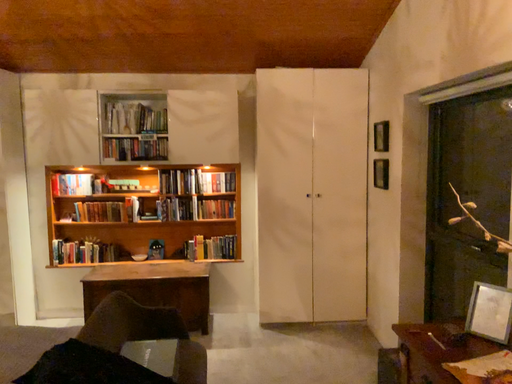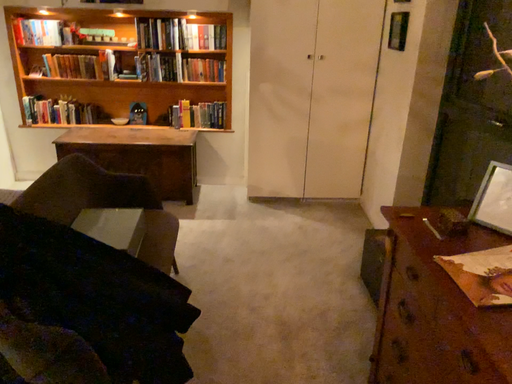
Question: Which way did the camera rotate in the video?

Choices:
 (A) rotated upward
 (B) rotated downward

Answer: (B)